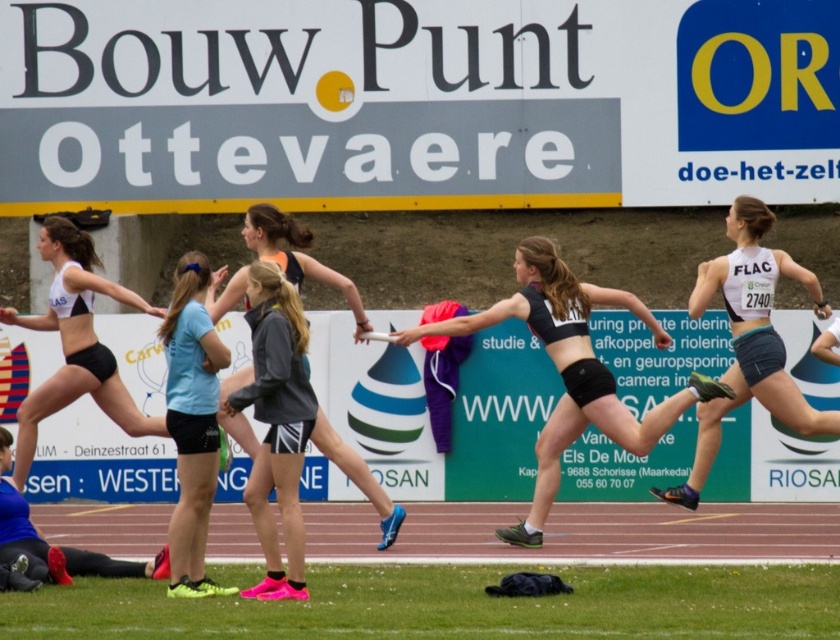
You are a spectator at the relay race and want to take a photo of the baton exchange between the white matte tank top at right and the blue synthetic track shoe at lower left. Which object should you focus on first to capture the moment when they are closest to each other?

The white matte tank top at right is positioned on the right side of the blue synthetic track shoe at lower left, so you should focus on the blue synthetic track shoe at lower left first to capture the moment when they are closest to each other.

You are a photographer at the relay race and need to capture a clear shot of both the black matte sports bra at center and the black matte jacket at center. Based on their sizes, which one will appear bigger in your photo?

The black matte sports bra at center will appear bigger in the photo because it has a larger size compared to the black matte jacket at center.